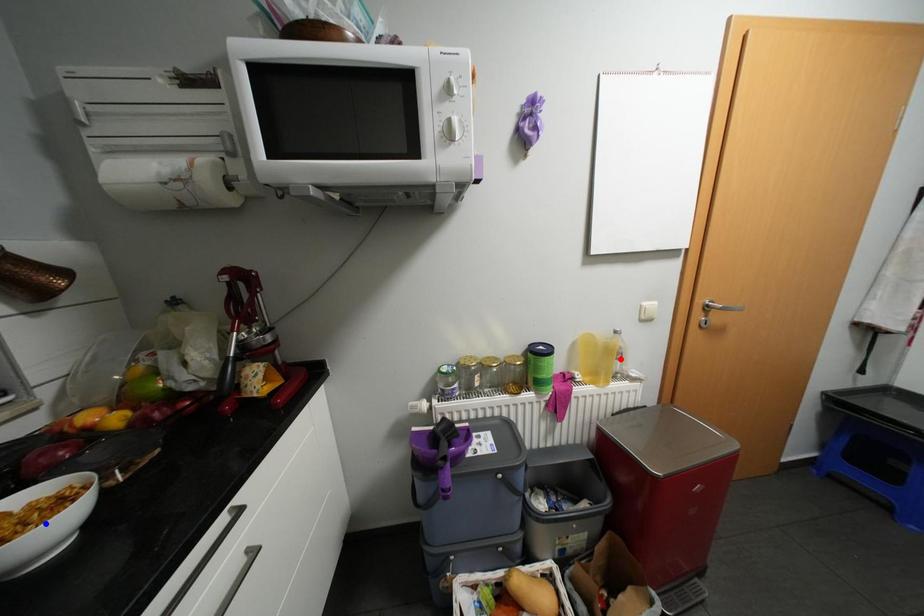
Question: Two points are marked on the image. Which point is closer to the camera?

Choices:
 (A) Blue point is closer.
 (B) Red point is closer.

Answer: (A)